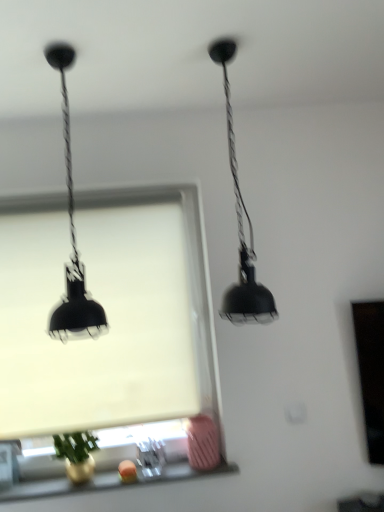
Question: From a real-world perspective, relative to black matte pendant light at upper center, positioned as the 1th lamp in right-to-left order, is matte black lamp at left, the first lamp viewed from the left, vertically above or below?

Choices:
 (A) above
 (B) below

Answer: (A)

Question: From their relative heights in the image, would you say matte black lamp at left, acting as the second lamp starting from the right, is taller or shorter than black matte pendant light at upper center, which is counted as the second lamp, starting from the left?

Choices:
 (A) short
 (B) tall

Answer: (A)

Question: Estimate the real-world distances between objects in this image. Which object is farther from the white matte window screen at center?

Choices:
 (A) matte glass window sill at lower center
 (B) black matte pendant light at upper center, which is counted as the second lamp, starting from the left
 (C) matte black lamp at left, acting as the second lamp starting from the right

Answer: (B)

Question: Which is farther from the matte black lamp at left, the first lamp viewed from the left?

Choices:
 (A) white matte window screen at center
 (B) matte glass window sill at lower center
 (C) black matte pendant light at upper center, which is counted as the second lamp, starting from the left

Answer: (B)